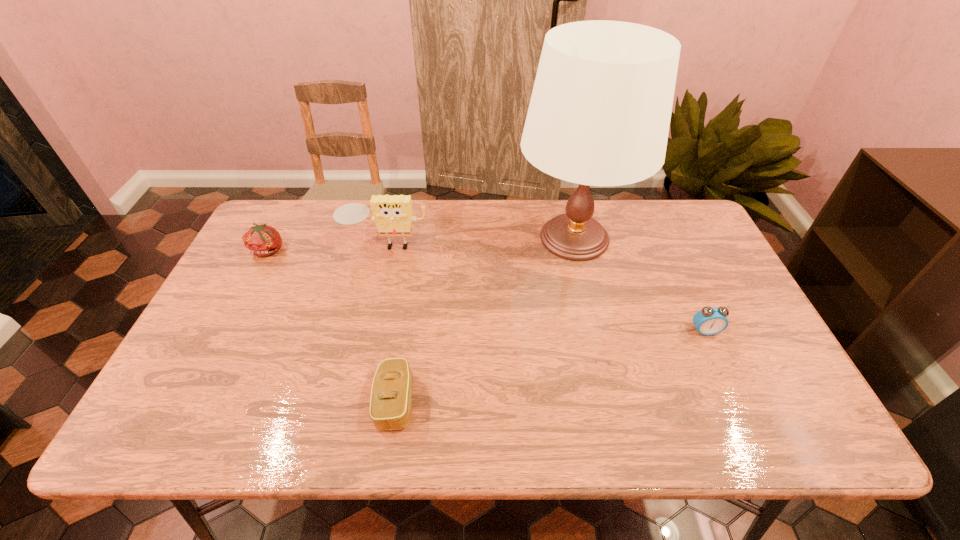
This screenshot has width=960, height=540. In order to click on vacant space located 0.180m on the face of the rightmost object in this screenshot , I will do `click(736, 400)`.

This screenshot has width=960, height=540. Find the location of `vacant space located 0.120m on the zipper side of the clutch bag`. vacant space located 0.120m on the zipper side of the clutch bag is located at coordinates (468, 402).

Where is `lamp at the far edge`? The image size is (960, 540). lamp at the far edge is located at coordinates (599, 114).

This screenshot has height=540, width=960. Identify the location of sponge positioned at the far edge. (393, 214).

Find the location of a particular element. tomato that is at the far edge is located at coordinates click(261, 240).

Where is `object that is at the near edge`? This screenshot has height=540, width=960. object that is at the near edge is located at coordinates (391, 396).

You are a GUI agent. You are given a task and a screenshot of the screen. Output one action in this format:
    pyautogui.click(x=<x>, y=<y>)
    Task: Click on the object that is at the left edge
    
    Given the screenshot: What is the action you would take?
    pyautogui.click(x=261, y=240)

Where is `object present at the right edge`? The height and width of the screenshot is (540, 960). object present at the right edge is located at coordinates point(710,320).

You are a GUI agent. You are given a task and a screenshot of the screen. Output one action in this format:
    pyautogui.click(x=<x>, y=<y>)
    Task: Click on the object located in the far left corner section of the desktop
    The image size is (960, 540).
    Given the screenshot: What is the action you would take?
    pyautogui.click(x=261, y=240)

What are the coordinates of `free space at the far edge of the desktop` in the screenshot? It's located at (613, 201).